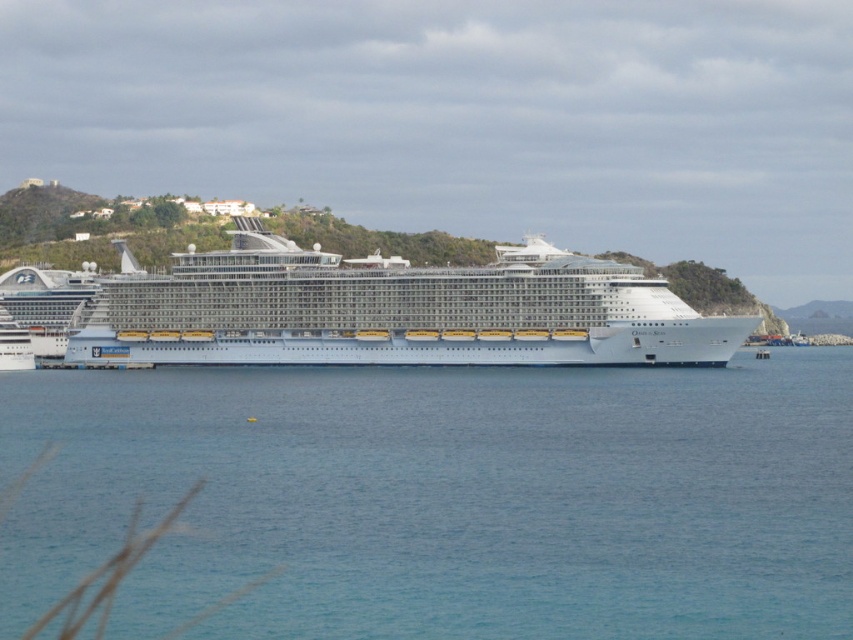
Which is in front, point (474, 522) or point (331, 307)?

Point (474, 522)

Looking at this image, who is more distant from viewer, (186, 454) or (669, 362)?

Positioned behind is point (669, 362).

Is point (538, 432) more distant than point (216, 321)?

No, it is not.

Locate an element on the screen. The height and width of the screenshot is (640, 853). blue water at center is located at coordinates (445, 497).